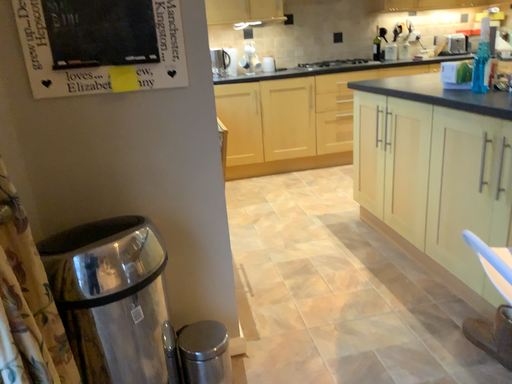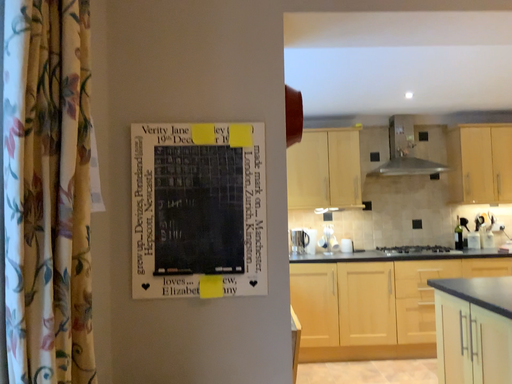
Question: Which way did the camera rotate in the video?

Choices:
 (A) rotated downward
 (B) rotated upward

Answer: (B)